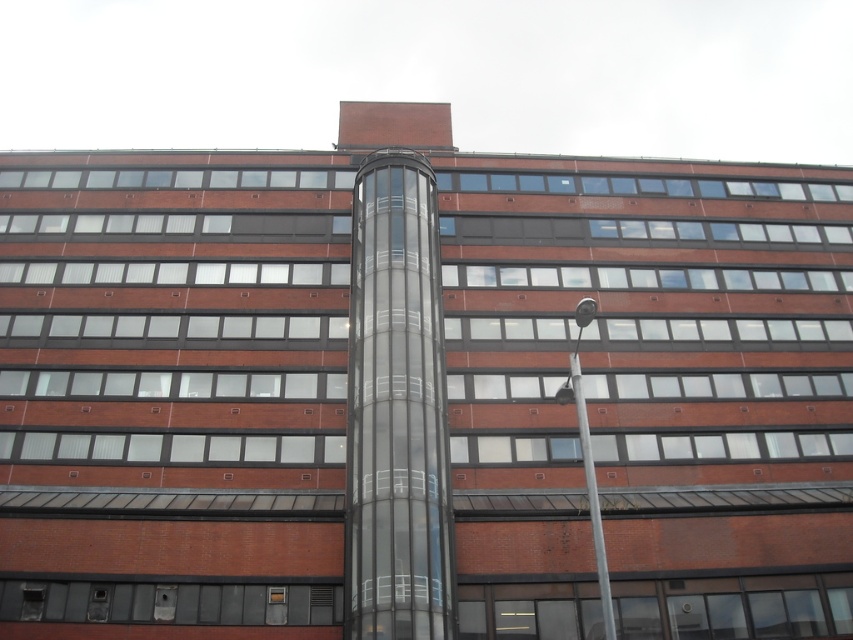
You are an architect analyzing the building facade. Which object, the transparent glass elevator at center or the silver metallic pole at upper right, has a greater height?

The transparent glass elevator at center is much taller than the silver metallic pole at upper right.

You are an architect examining the building facade. You notice the transparent glass elevator at center and the silver metallic pole at upper right. Which object is closer to the left edge of the building?

The transparent glass elevator at center is positioned on the left side of silver metallic pole at upper right, so it is closer to the left edge of the building.

You are standing in front of the building and notice the transparent glass elevator at center and the silver metallic pole at upper right. Which object is located higher up on the building?

The transparent glass elevator at center is positioned over the silver metallic pole at upper right, meaning it is higher up on the building.